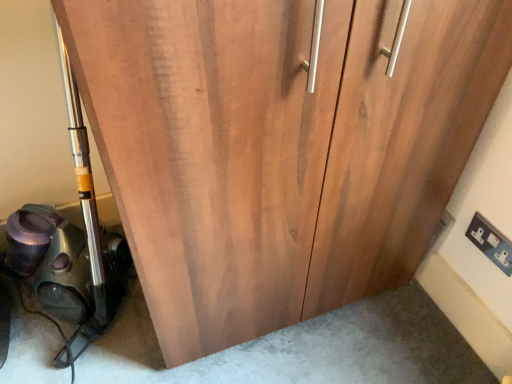
Question: Choose the correct answer: Is white plastic electric outlet at lower right inside metallic vacuum cleaner at left or outside it?

Choices:
 (A) outside
 (B) inside

Answer: (A)

Question: Is white plastic electric outlet at lower right in front of or behind metallic vacuum cleaner at left in the image?

Choices:
 (A) front
 (B) behind

Answer: (B)

Question: Is white plastic electric outlet at lower right to the left or to the right of metallic vacuum cleaner at left in the image?

Choices:
 (A) right
 (B) left

Answer: (A)

Question: Considering the positions of metallic vacuum cleaner at left and white plastic electric outlet at lower right in the image, is metallic vacuum cleaner at left bigger or smaller than white plastic electric outlet at lower right?

Choices:
 (A) big
 (B) small

Answer: (A)

Question: In terms of height, does metallic vacuum cleaner at left look taller or shorter compared to white plastic electric outlet at lower right?

Choices:
 (A) tall
 (B) short

Answer: (A)

Question: Looking at their shapes, would you say metallic vacuum cleaner at left is wider or thinner than white plastic electric outlet at lower right?

Choices:
 (A) wide
 (B) thin

Answer: (A)

Question: Based on their positions, is metallic vacuum cleaner at left located to the left or right of white plastic electric outlet at lower right?

Choices:
 (A) right
 (B) left

Answer: (B)